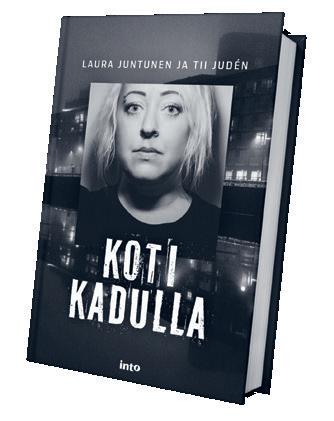
I want to click on book, so click(263, 44).